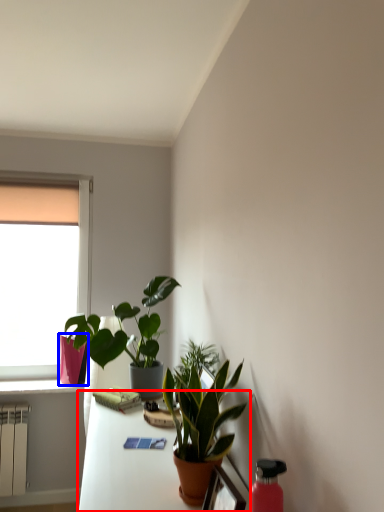
Question: Which point is closer to the camera, table (highlighted by a red box) or flowerpot (highlighted by a blue box)?

Choices:
 (A) table
 (B) flowerpot

Answer: (A)